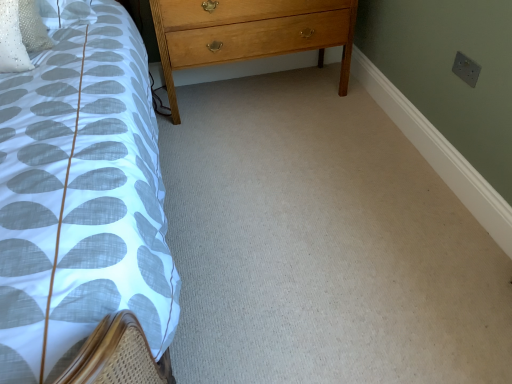
You are a GUI agent. You are given a task and a screenshot of the screen. Output one action in this format:
    pyautogui.click(x=<x>, y=<y>)
    Task: Click on the free spot in front of light brown wood chest of drawers at center
    The width and height of the screenshot is (512, 384).
    Given the screenshot: What is the action you would take?
    pyautogui.click(x=272, y=154)